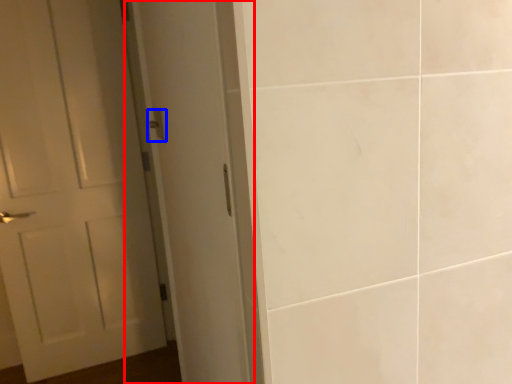
Question: Which point is further to the camera, screen door (highlighted by a red box) or door handle (highlighted by a blue box)?

Choices:
 (A) screen door
 (B) door handle

Answer: (A)